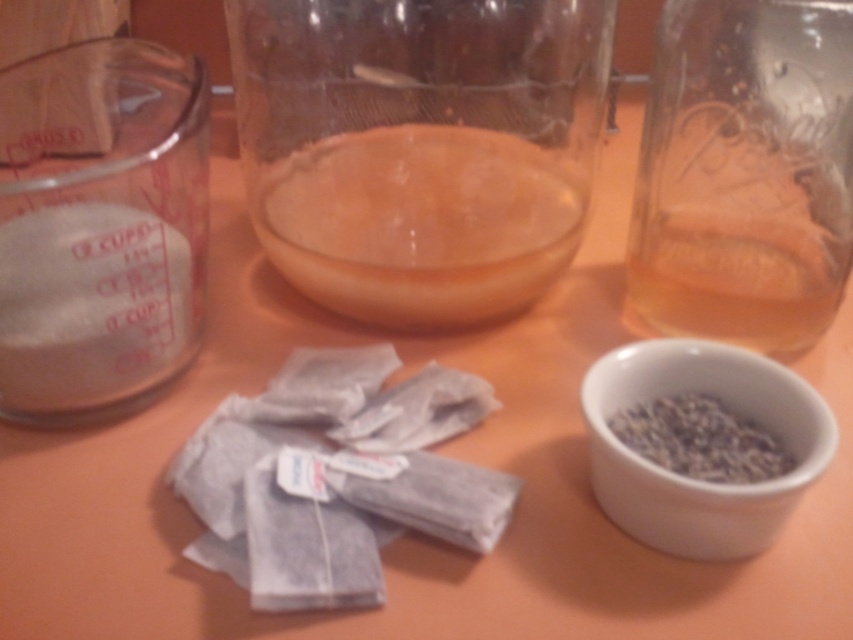
You are a chef preparing a recipe that requires precise measurements. You have two containers on the table, the transparent glass jar at upper right and the dark gray granular at lower right. Which container has a larger width?

The transparent glass jar at upper right has a larger width than the dark gray granular at lower right according to the description.

Looking at this image, you are preparing a recipe that requires you to pour the contents of the dark gray granular at lower right into the white ceramic bowl at lower right. Given the size of the bowl and the granular, will the bowl be able to hold all of the granular without spilling?

The white ceramic bowl at lower right is larger in size than the dark gray granular at lower right, so yes, the bowl can hold all of the dark gray granular at lower right without spilling.

You are preparing a recipe and need to place the white ceramic bowl at lower right and the dark gray granular at lower right on a shelf. If the shelf has limited space, which item should you place first to ensure both fit properly?

The white ceramic bowl at lower right should be placed first since it is positioned on the left side of the dark gray granular at lower right, meaning it takes up less space on the left, allowing the dark gray granular to be placed to its right without exceeding the shelf space.